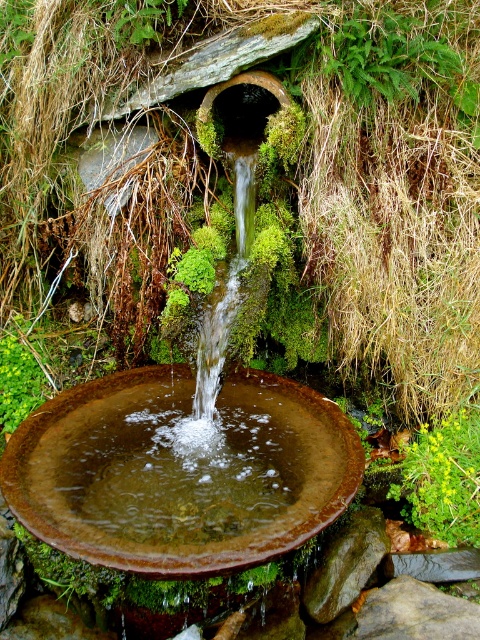
Which is below, green leafy plant at lower right or brown rough stone at center?

brown rough stone at center is lower down.

Is point (470, 451) closer to camera compared to point (374, 630)?

No, (470, 451) is further to viewer.

Identify the location of green leafy plant at lower right. click(x=444, y=477).

Between rusty metal bird bath at center and green leafy plant at lower right, which one is positioned lower?

green leafy plant at lower right is below.

The image size is (480, 640). Describe the element at coordinates (180, 472) in the screenshot. I see `rusty metal bird bath at center` at that location.

In order to click on rusty metal bird bath at center in this screenshot , I will do `click(180, 472)`.

In the scene shown: Does rusty metal bird bath at center have a smaller size compared to brown rough stone at center?

Incorrect, rusty metal bird bath at center is not smaller in size than brown rough stone at center.

Is rusty metal bird bath at center shorter than brown rough stone at center?

No.

What do you see at coordinates (180, 472) in the screenshot? I see `rusty metal bird bath at center` at bounding box center [180, 472].

At what (x,y) coordinates should I click in order to perform the action: click on rusty metal bird bath at center. Please return your answer as a coordinate pair (x, y). Looking at the image, I should click on (180, 472).